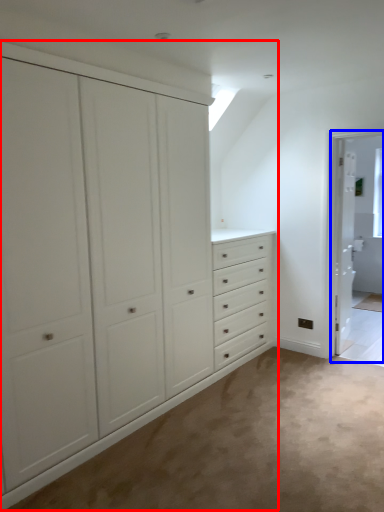
Question: Which of the following is the closest to the observer, cupboard (highlighted by a red box) or screen door (highlighted by a blue box)?

Choices:
 (A) cupboard
 (B) screen door

Answer: (A)